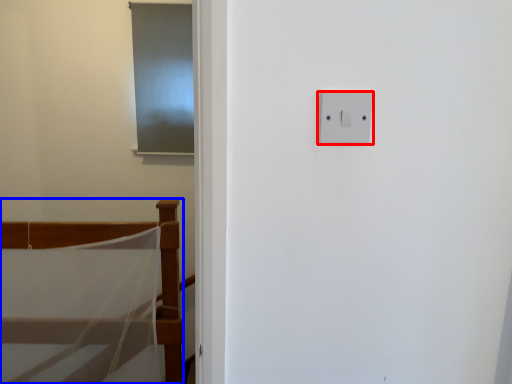
Question: Which object appears farthest to the camera in this image, light switch (highlighted by a red box) or furniture (highlighted by a blue box)?

Choices:
 (A) light switch
 (B) furniture

Answer: (B)